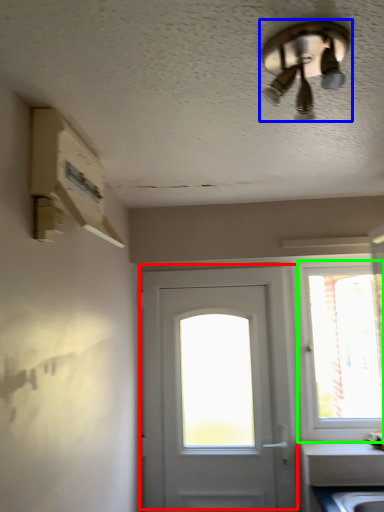
Question: Estimate the real-world distances between objects in this image. Which object is farther from door (highlighted by a red box), ceiling fan (highlighted by a blue box) or window (highlighted by a green box)?

Choices:
 (A) ceiling fan
 (B) window

Answer: (B)